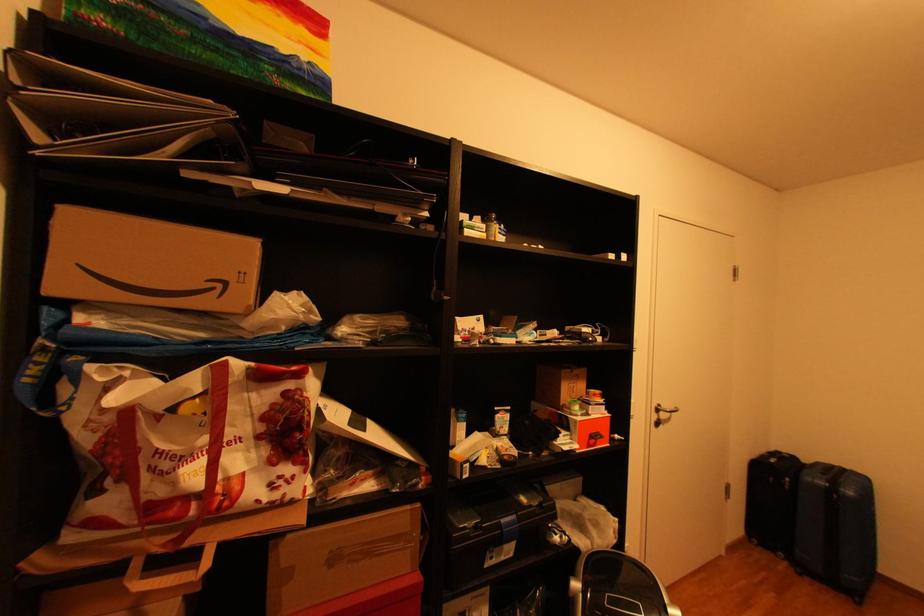
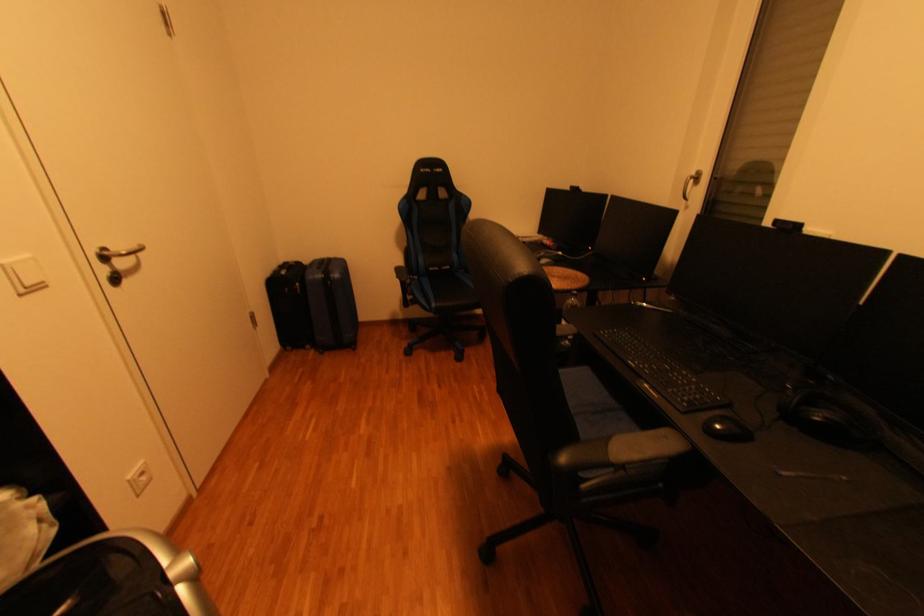
How did the camera likely rotate?

The camera's rotation is toward right-down.